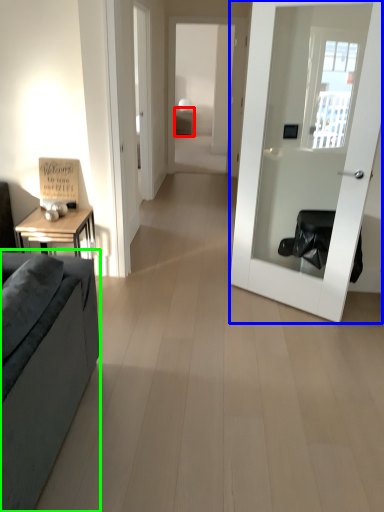
Question: Which is farther away from table (highlighted by a red box)? door (highlighted by a blue box) or studio couch (highlighted by a green box)?

Choices:
 (A) door
 (B) studio couch

Answer: (B)